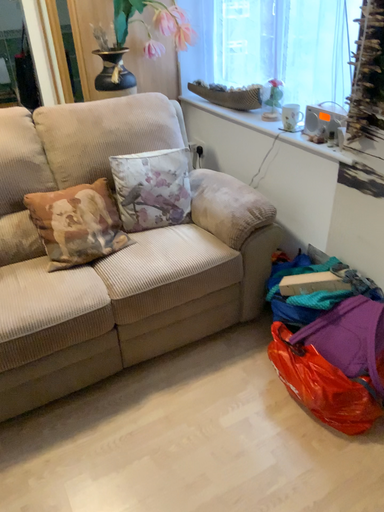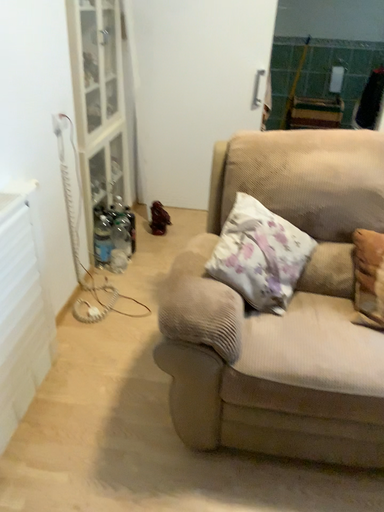
Question: How did the camera likely rotate when shooting the video?

Choices:
 (A) rotated upward
 (B) rotated downward

Answer: (A)